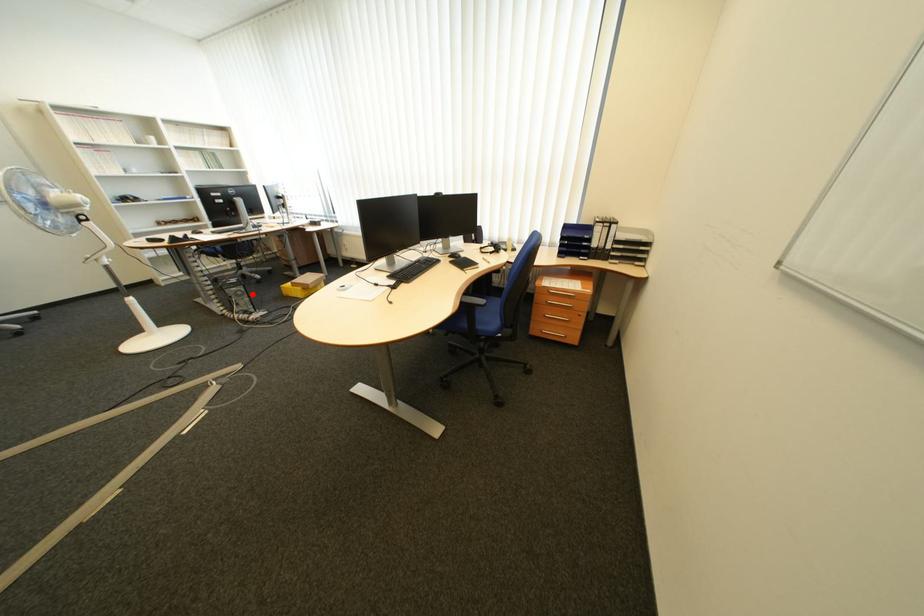
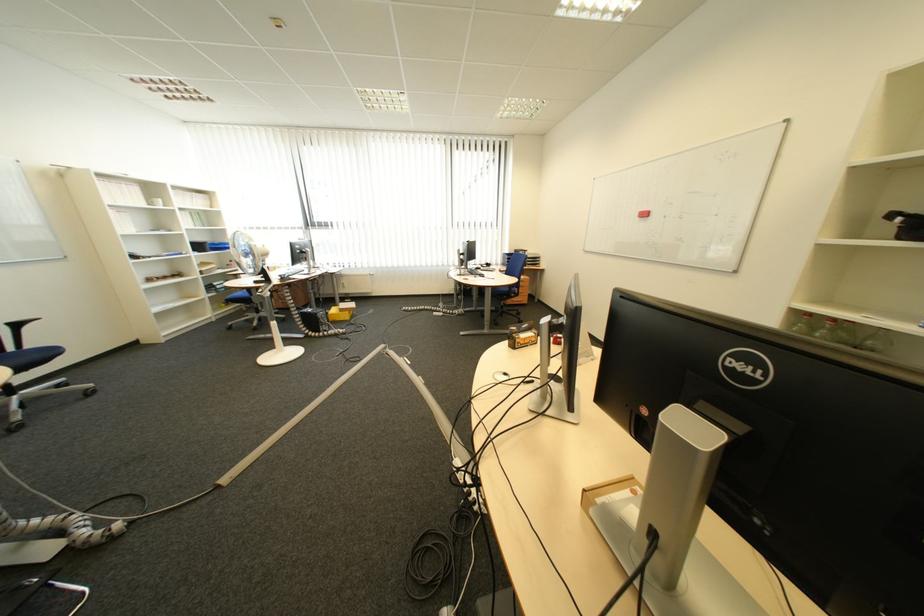
Question: A red point is marked in image1. In image2, is the corresponding 3D point closer to the camera or farther? Reply with the corresponding letter.

Choices:
 (A) The corresponding 3D point is closer.
 (B) The corresponding 3D point is farther.

Answer: (A)